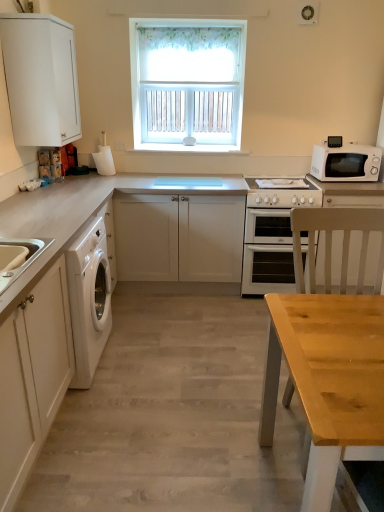
Question: Should I look upward or downward to see white matte cabinet at upper left, the 3th cabinetry in the bottom-to-top sequence?

Choices:
 (A) down
 (B) up

Answer: (B)

Question: Would you say wooden table at center contains white matte microwave at right?

Choices:
 (A) yes
 (B) no

Answer: (B)

Question: From a real-world perspective, is wooden table at center on white matte microwave at right?

Choices:
 (A) yes
 (B) no

Answer: (B)

Question: Considering the relative positions of wooden table at center and white matte microwave at right in the image provided, is wooden table at center in front of white matte microwave at right?

Choices:
 (A) no
 (B) yes

Answer: (B)

Question: Can you confirm if wooden table at center is smaller than white matte microwave at right?

Choices:
 (A) yes
 (B) no

Answer: (B)

Question: From a real-world perspective, is wooden table at center physically below white matte microwave at right?

Choices:
 (A) yes
 (B) no

Answer: (A)

Question: Considering the relative positions of wooden table at center and white matte microwave at right in the image provided, is wooden table at center to the right of white matte microwave at right from the viewer's perspective?

Choices:
 (A) no
 (B) yes

Answer: (A)

Question: Can you confirm if white matte washing machine at left is taller than white matte cabinet at center, which appears as the 3th cabinetry when viewed from the front?

Choices:
 (A) no
 (B) yes

Answer: (B)

Question: Considering the relative sizes of white matte washing machine at left and white matte cabinet at center, which appears as the 3th cabinetry when viewed from the front, in the image provided, is white matte washing machine at left bigger than white matte cabinet at center, which appears as the 3th cabinetry when viewed from the front,?

Choices:
 (A) yes
 (B) no

Answer: (B)

Question: From a real-world perspective, is white matte washing machine at left beneath white matte cabinet at center, which is the 1th cabinetry in back-to-front order?

Choices:
 (A) no
 (B) yes

Answer: (B)

Question: Is white matte washing machine at left located outside white matte cabinet at center, which ranks as the second cabinetry in bottom-to-top order?

Choices:
 (A) yes
 (B) no

Answer: (A)

Question: From the image's perspective, is white matte washing machine at left above white matte cabinet at center, placed as the 2th cabinetry when sorted from top to bottom?

Choices:
 (A) yes
 (B) no

Answer: (B)

Question: Is white matte washing machine at left turned away from white matte cabinet at center, which appears as the 3th cabinetry when viewed from the front?

Choices:
 (A) no
 (B) yes

Answer: (A)

Question: Does white matte cabinet at center, which is the 1th cabinetry in back-to-front order, come in front of white matte cabinet at left, the 3th cabinetry when ordered from back to front?

Choices:
 (A) yes
 (B) no

Answer: (B)